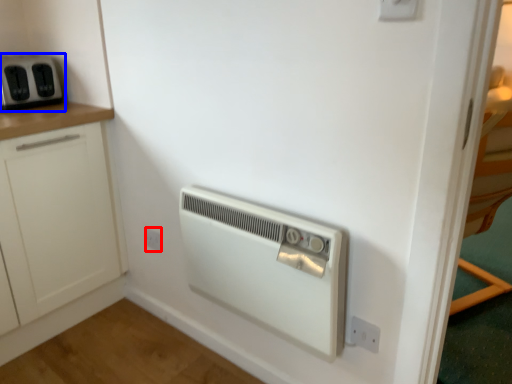
Question: Which of the following is the closest to the observer, electric outlet (highlighted by a red box) or home appliance (highlighted by a blue box)?

Choices:
 (A) electric outlet
 (B) home appliance

Answer: (B)